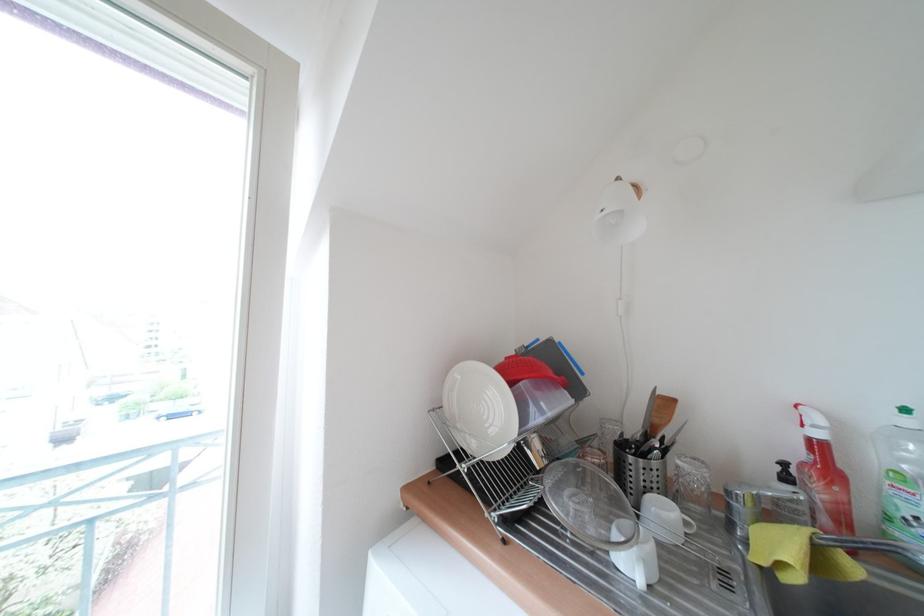
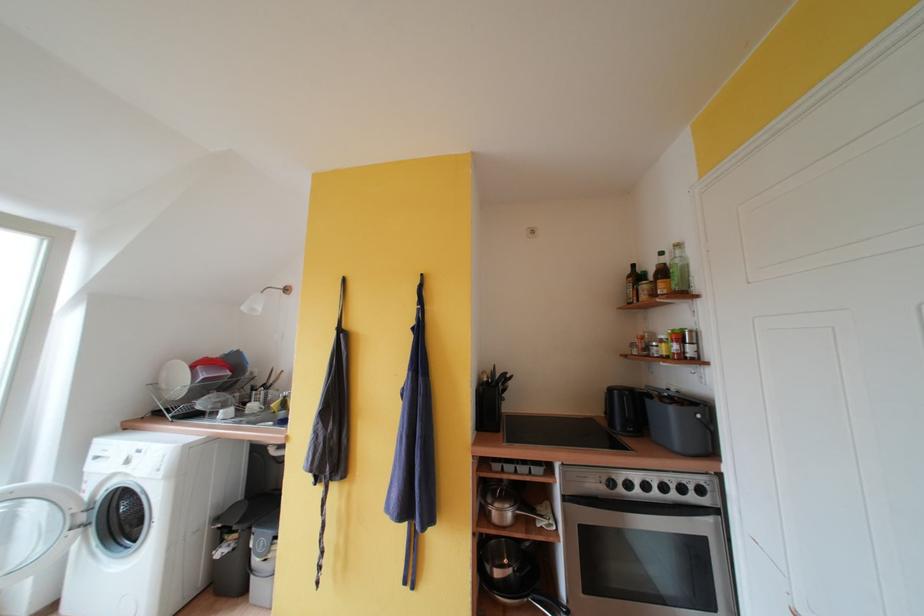
Locate, in the second image, the point that corresponds to point (444, 413) in the first image.

(160, 387)